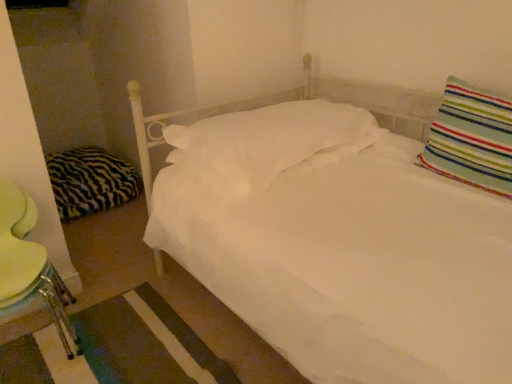
Question: Considering the relative positions of zebra-patterned fabric pillow at left, acting as the 1th pillow starting from the left, and striped fabric pillow at upper right, the first pillow when ordered from right to left, in the image provided, is zebra-patterned fabric pillow at left, acting as the 1th pillow starting from the left, in front of striped fabric pillow at upper right, the first pillow when ordered from right to left,?

Choices:
 (A) no
 (B) yes

Answer: (A)

Question: Is zebra-patterned fabric pillow at left, the third pillow in the right-to-left sequence, far from striped fabric pillow at upper right, which is counted as the 3th pillow, starting from the back?

Choices:
 (A) no
 (B) yes

Answer: (B)

Question: From a real-world perspective, is zebra-patterned fabric pillow at left, acting as the 1th pillow starting from the left, over striped fabric pillow at upper right, which appears as the third pillow when viewed from the left?

Choices:
 (A) no
 (B) yes

Answer: (A)

Question: Does zebra-patterned fabric pillow at left, the first pillow positioned from the back, appear on the left side of striped fabric pillow at upper right, the first pillow when ordered from right to left?

Choices:
 (A) no
 (B) yes

Answer: (B)

Question: Considering the relative sizes of zebra-patterned fabric pillow at left, the first pillow positioned from the back, and striped fabric pillow at upper right, the first pillow when ordered from right to left, in the image provided, is zebra-patterned fabric pillow at left, the first pillow positioned from the back, bigger than striped fabric pillow at upper right, the first pillow when ordered from right to left,?

Choices:
 (A) no
 (B) yes

Answer: (B)

Question: Would you say zebra-patterned fabric pillow at left, the third pillow in the right-to-left sequence, is inside or outside metallic green swivel chair at lower left?

Choices:
 (A) inside
 (B) outside

Answer: (B)

Question: From their relative heights in the image, would you say zebra-patterned fabric pillow at left, the first pillow positioned from the back, is taller or shorter than metallic green swivel chair at lower left?

Choices:
 (A) tall
 (B) short

Answer: (B)

Question: From the image's perspective, is zebra-patterned fabric pillow at left, the first pillow positioned from the back, positioned above or below metallic green swivel chair at lower left?

Choices:
 (A) above
 (B) below

Answer: (A)

Question: Is point (100, 192) closer or farther from the camera than point (1, 276)?

Choices:
 (A) closer
 (B) farther

Answer: (B)

Question: Visually, is metallic green swivel chair at lower left positioned to the left or to the right of striped fabric pillow at upper right, which appears as the third pillow when viewed from the left?

Choices:
 (A) right
 (B) left

Answer: (B)

Question: Relative to striped fabric pillow at upper right, the 1th pillow in the front-to-back sequence, is metallic green swivel chair at lower left in front or behind?

Choices:
 (A) behind
 (B) front

Answer: (B)

Question: Does point (44, 284) appear closer or farther from the camera than point (488, 125)?

Choices:
 (A) closer
 (B) farther

Answer: (B)

Question: Is metallic green swivel chair at lower left wider or thinner than striped fabric pillow at upper right, the 1th pillow in the front-to-back sequence?

Choices:
 (A) wide
 (B) thin

Answer: (A)

Question: Is point (461, 150) positioned closer to the camera than point (47, 294)?

Choices:
 (A) closer
 (B) farther

Answer: (B)

Question: Which is correct: striped fabric pillow at upper right, the 1th pillow in the front-to-back sequence, is inside metallic green swivel chair at lower left, or outside of it?

Choices:
 (A) outside
 (B) inside

Answer: (A)